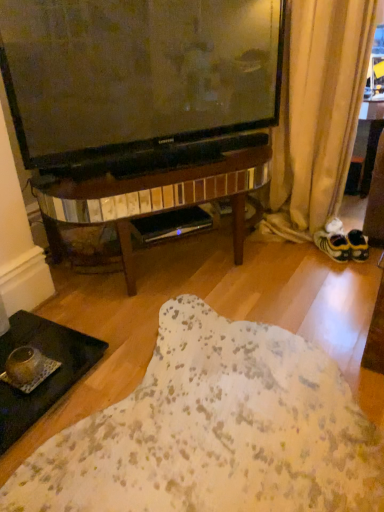
Question: Considering their positions, is beige fabric curtain at lower right located in front of or behind black glass tray at lower left?

Choices:
 (A) behind
 (B) front

Answer: (A)

Question: Considering the positions of point (274, 132) and point (49, 332), is point (274, 132) closer or farther from the camera than point (49, 332)?

Choices:
 (A) closer
 (B) farther

Answer: (B)

Question: Considering the real-world distances, which object is farthest from the yellow fabric shoe at right?

Choices:
 (A) beige fabric curtain at lower right
 (B) black glass tray at lower left

Answer: (B)

Question: Considering the real-world distances, which object is farthest from the yellow fabric shoe at right?

Choices:
 (A) black glass tray at lower left
 (B) beige fabric curtain at lower right

Answer: (A)